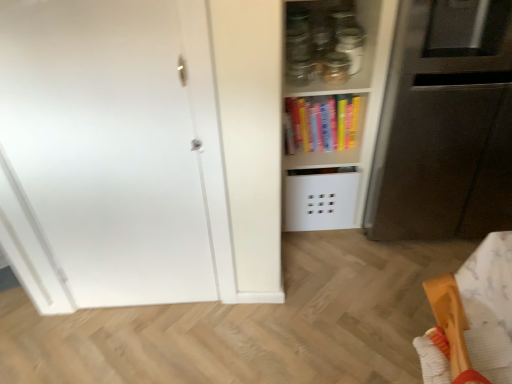
The width and height of the screenshot is (512, 384). I want to click on vacant area in front of white matte door at left, so click(145, 344).